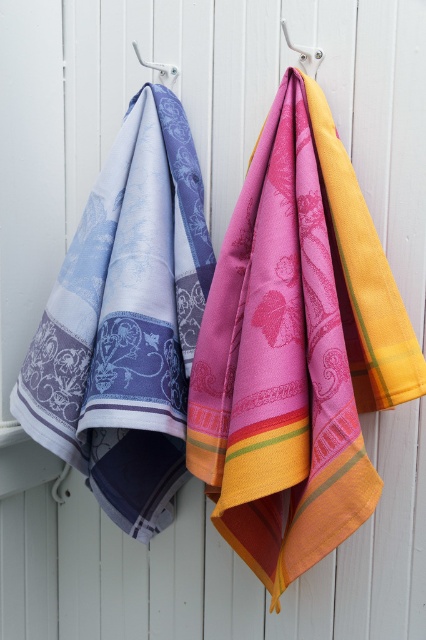
In the scene shown: You are standing in front of the wall with the colorful towels. You want to touch the point that is closer to you. Which point should you choose between point (238, 204) and point (92, 305)?

Point (238, 204) is closer to the camera than point (92, 305), so you should choose point (238, 204).

You are organizing towels in a bathroom and need to place the pink woven towel at center and the matte blue and purple fabric at left according to their positions. Which one is positioned to the right side of the other?

The pink woven towel at center is positioned to the right of the matte blue and purple fabric at left.